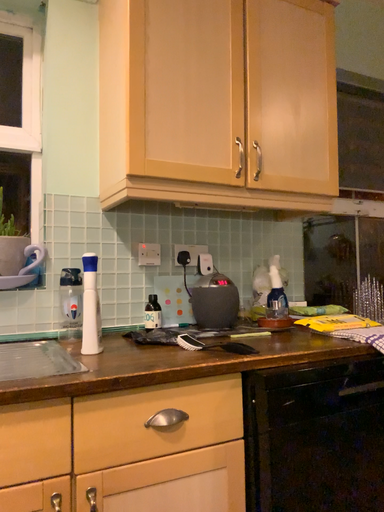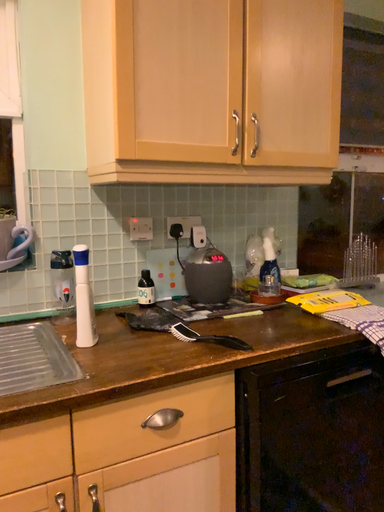
Question: Which way did the camera rotate in the video?

Choices:
 (A) rotated downward
 (B) rotated upward

Answer: (A)